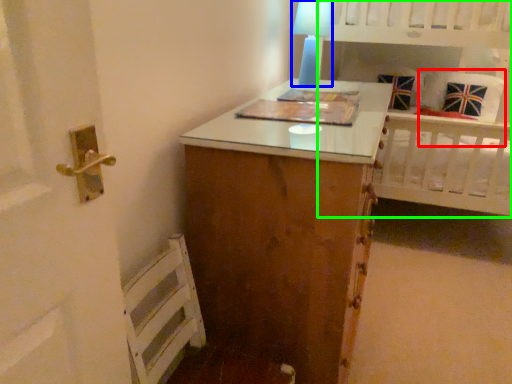
Question: Based on their relative distances, which object is nearer to pillow (highlighted by a red box)? Choose from table lamp (highlighted by a blue box) and bed (highlighted by a green box).

Choices:
 (A) table lamp
 (B) bed

Answer: (B)